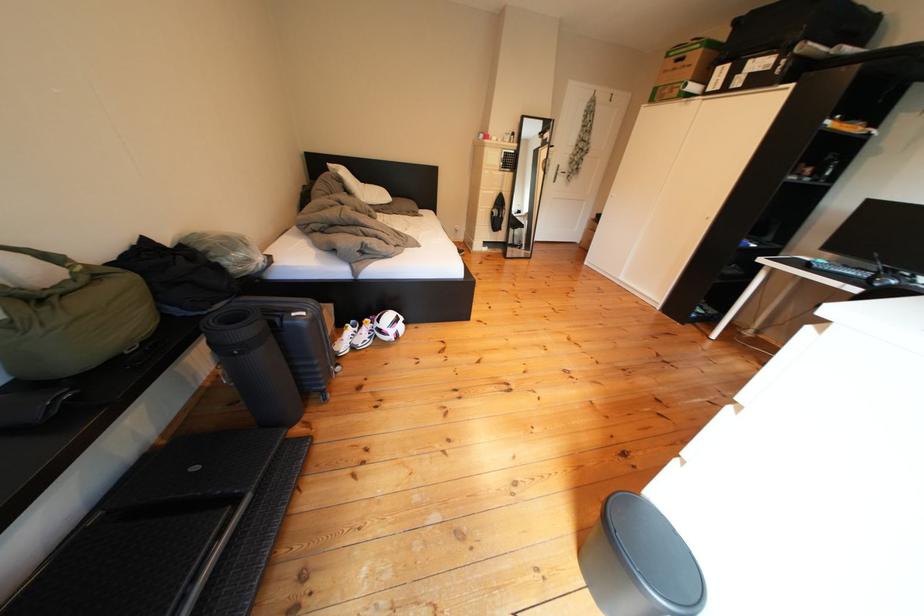
Find where to lift the brown cardboard box. Please return your answer as a coordinate pair (x, y).

(685, 68)